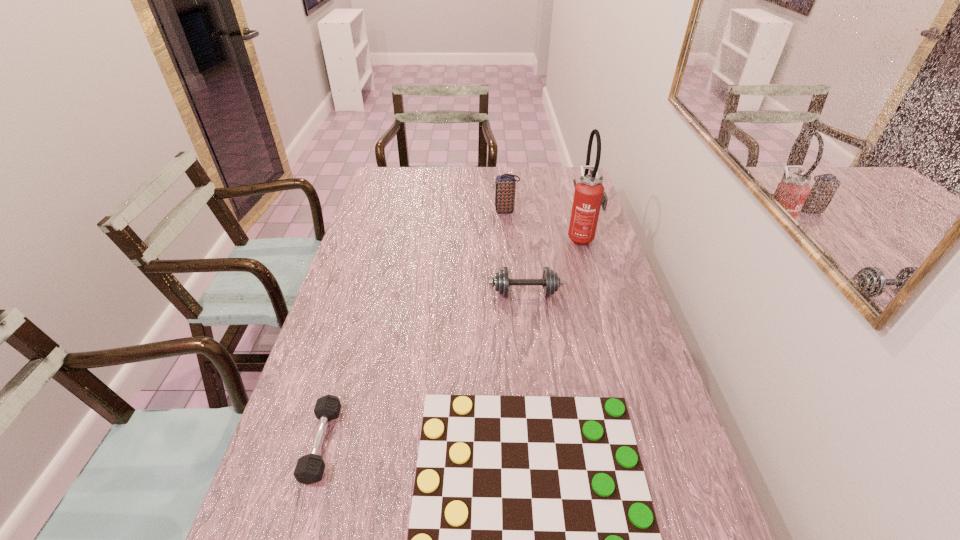
Locate an element on the screen. Image resolution: width=960 pixels, height=540 pixels. object that is the nearest to the fire extinguisher is located at coordinates (504, 184).

At what (x,y) coordinates should I click in order to perform the action: click on object that stands as the third closest to the farthest object. Please return your answer as a coordinate pair (x, y). Image resolution: width=960 pixels, height=540 pixels. Looking at the image, I should click on (532, 539).

Image resolution: width=960 pixels, height=540 pixels. What are the coordinates of `vacant space that satisfies the following two spatial constraints: 1. on the back side of the third nearest object; 2. on the left side of the left dumbbell` in the screenshot? It's located at (365, 293).

Locate an element on the screen. Image resolution: width=960 pixels, height=540 pixels. vacant space that satisfies the following two spatial constraints: 1. at the nozzle of the tallest object; 2. on the front side of the right dumbbell is located at coordinates (598, 293).